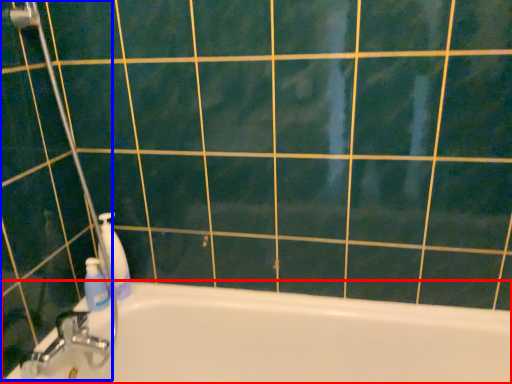
Question: Among these objects, which one is nearest to the camera, bathtub (highlighted by a red box) or shower door (highlighted by a blue box)?

Choices:
 (A) bathtub
 (B) shower door

Answer: (A)